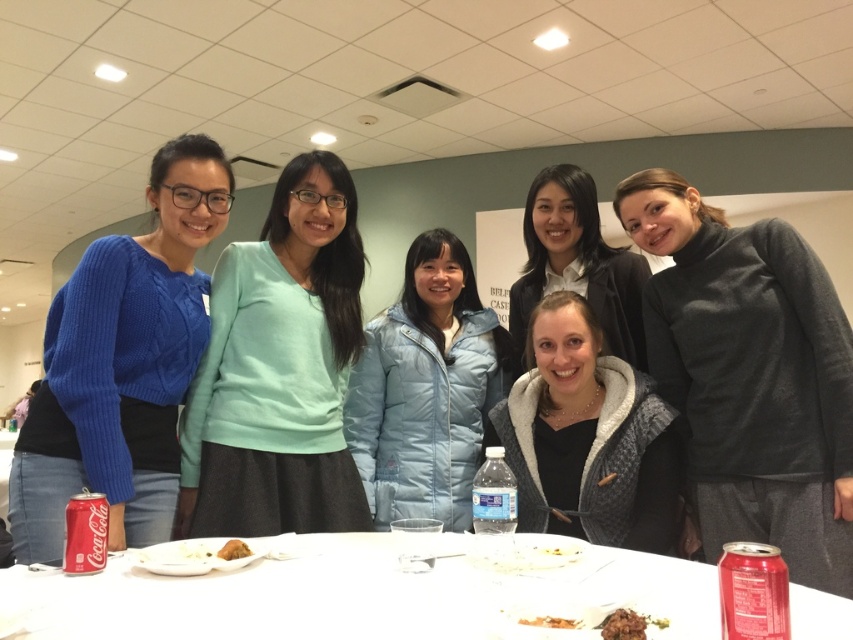
Question: Does matte teal sweater at center come behind clear plastic bottle at center?

Choices:
 (A) yes
 (B) no

Answer: (A)

Question: Based on their relative distances, which object is farther from the brown crispy meat at lower center?

Choices:
 (A) white plastic table at center
 (B) gray fuzzy jacket at lower center
 (C) matte white shirt at center

Answer: (C)

Question: Observing the image, what is the correct spatial positioning of matte white shirt at center in reference to red matte coca-cola can at lower left?

Choices:
 (A) below
 (B) above

Answer: (B)

Question: Which point appears farthest from the camera in this image?

Choices:
 (A) (308, 298)
 (B) (488, 404)
 (C) (230, 545)

Answer: (B)

Question: Based on their relative distances, which object is farther from the white plastic table at center?

Choices:
 (A) clear plastic bottle at center
 (B) matte white shirt at center
 (C) light blue puffer jacket at center

Answer: (B)

Question: Is matte teal sweater at center positioned in front of red matte coca-cola can at lower left?

Choices:
 (A) no
 (B) yes

Answer: (A)